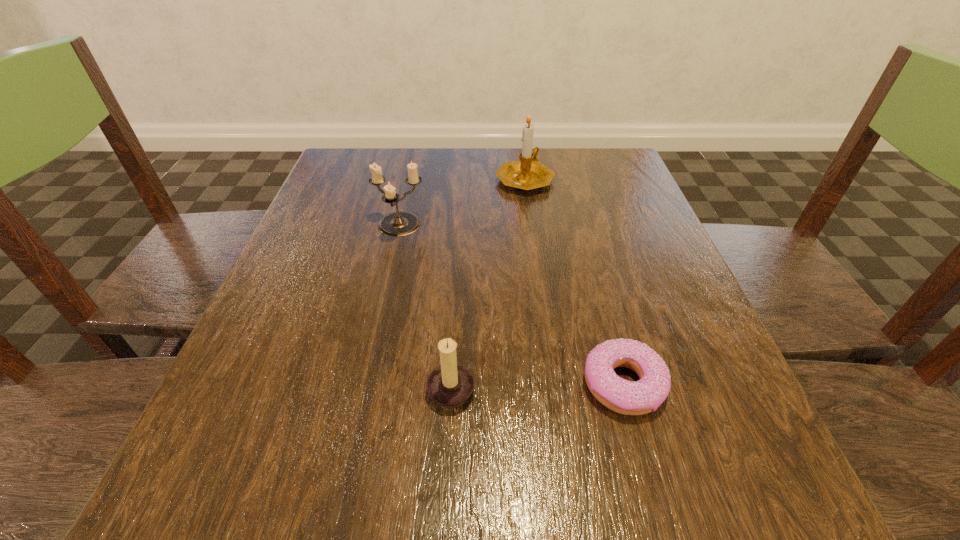
The height and width of the screenshot is (540, 960). I want to click on vacant region between the third object from right to left and the rightmost candle holder, so click(x=488, y=282).

Where is `vacant area between the shortest object and the farthest object`? The width and height of the screenshot is (960, 540). vacant area between the shortest object and the farthest object is located at coordinates (574, 280).

Locate an element on the screen. vacant space that's between the tallest candle holder and the second nearest candle holder is located at coordinates (462, 202).

The height and width of the screenshot is (540, 960). Identify the location of free space between the third shortest object and the farthest candle holder. (462, 202).

The width and height of the screenshot is (960, 540). What are the coordinates of `free spot between the rightmost candle holder and the shortest object` in the screenshot? It's located at (574, 280).

The image size is (960, 540). What are the coordinates of `free space between the farthest object and the shortest object` in the screenshot? It's located at (574, 280).

Locate an element on the screen. The image size is (960, 540). free area in between the tallest candle holder and the second tallest object is located at coordinates click(462, 202).

You are a GUI agent. You are given a task and a screenshot of the screen. Output one action in this format:
    pyautogui.click(x=<x>, y=<y>)
    Task: Click on the free space between the farthest candle holder and the leftmost candle holder
    This screenshot has width=960, height=540.
    Given the screenshot: What is the action you would take?
    pyautogui.click(x=462, y=202)

Select which object is the second closest to the leftmost candle holder. Please provide its 2D coordinates. Your answer should be formatted as a tuple, i.e. [(x, y)], where the tuple contains the x and y coordinates of a point satisfying the conditions above.

[(451, 384)]

This screenshot has width=960, height=540. I want to click on object that stands as the second closest to the shortest candle holder, so click(400, 223).